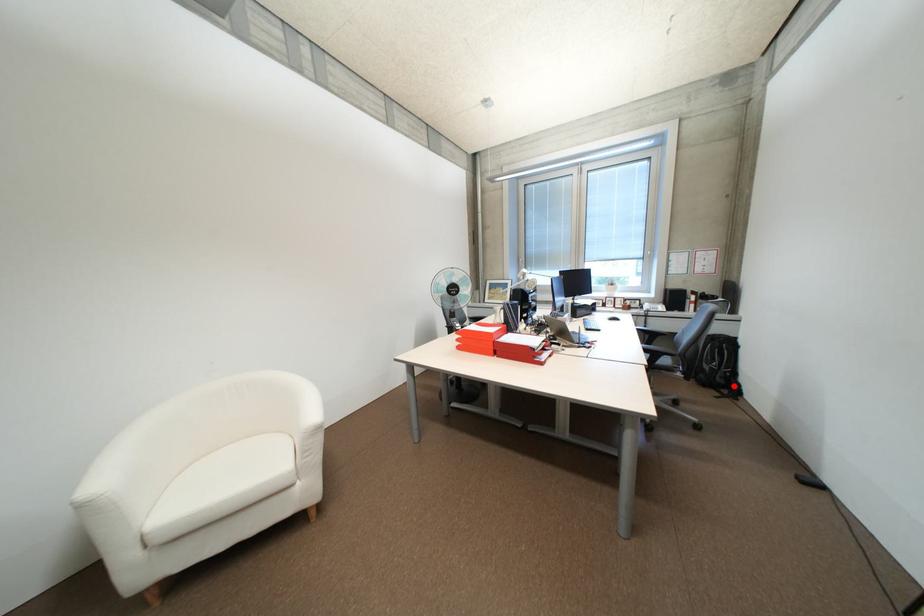
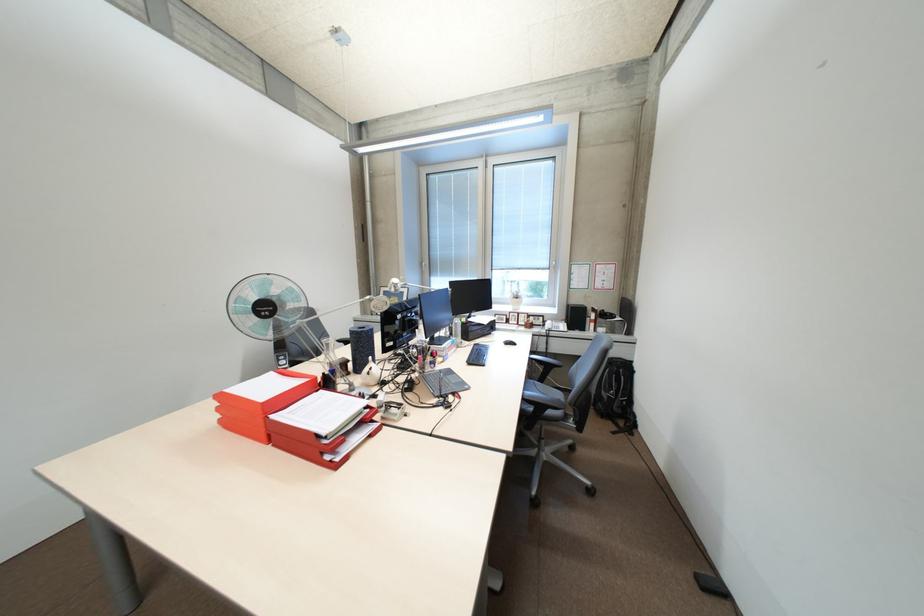
Question: I am providing you with two images of the same scene from different viewpoints. A red point is marked on the first image. Can you still see the location of the red point in image 2?

Choices:
 (A) Yes
 (B) No

Answer: (A)